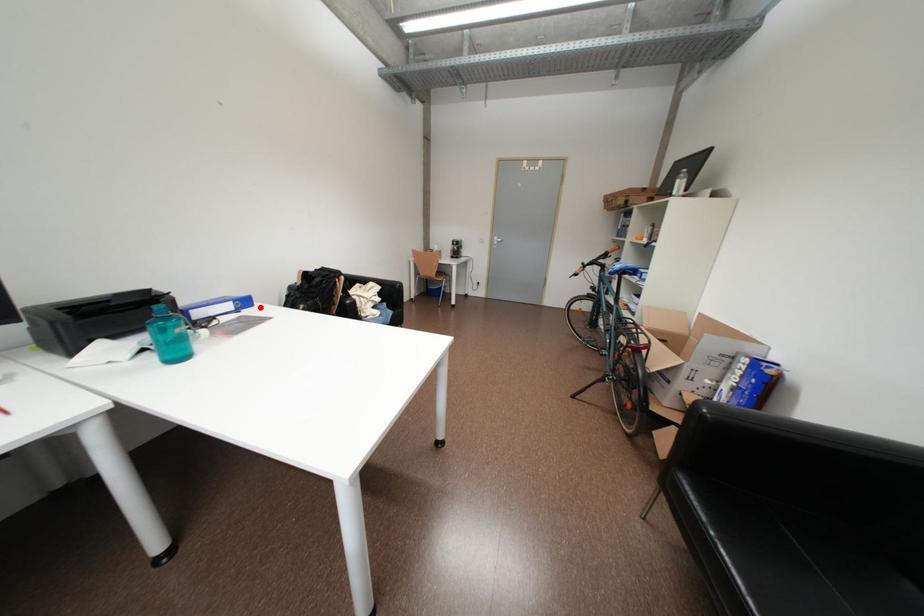
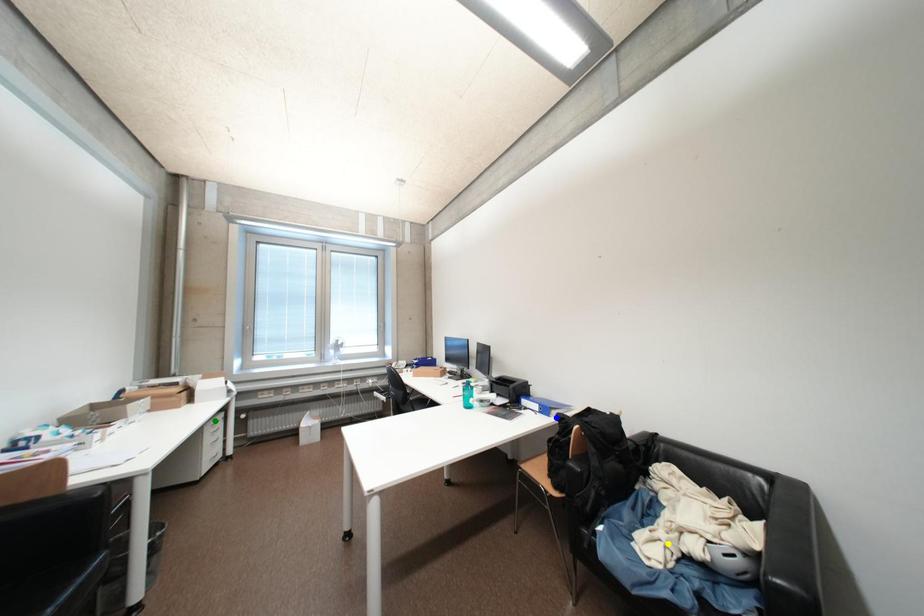
Question: I am providing you with two images of the same scene from different viewpoints. A red point is marked on the first image. You are given multiple points on the second image. In image 2, which mark is for the same physical point as the one in image 1?

Choices:
 (A) blue point
 (B) green point
 (C) yellow point

Answer: (A)